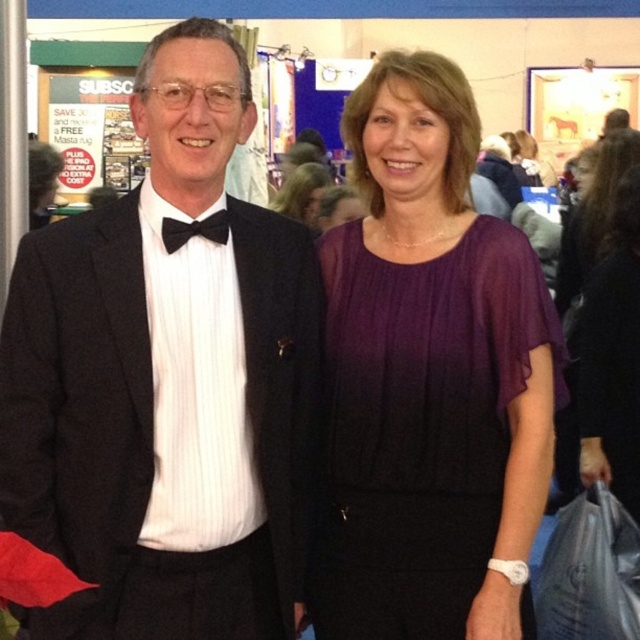
Who is lower down, black satin suit at center or black satin bow tie at center?

Positioned lower is black satin suit at center.

Is point (115, 266) less distant than point (193, 234)?

That is True.

I want to click on black satin suit at center, so click(166, 381).

Does black satin suit at center have a lesser height compared to purple sheer dress at center?

Yes, black satin suit at center is shorter than purple sheer dress at center.

Is point (150, 97) in front of point (512, 452)?

Yes, it is.

Identify the location of black satin suit at center. The image size is (640, 640). (166, 381).

Is point (120, 449) more distant than point (296, 189)?

No, it is in front of (296, 189).

Can you confirm if black satin suit at center is wider than purple satin dress at center?

Indeed, black satin suit at center has a greater width compared to purple satin dress at center.

Is point (266, 614) positioned in front of point (291, 195)?

Yes, point (266, 614) is in front of point (291, 195).

The width and height of the screenshot is (640, 640). What are the coordinates of `black satin suit at center` in the screenshot? It's located at (166, 381).